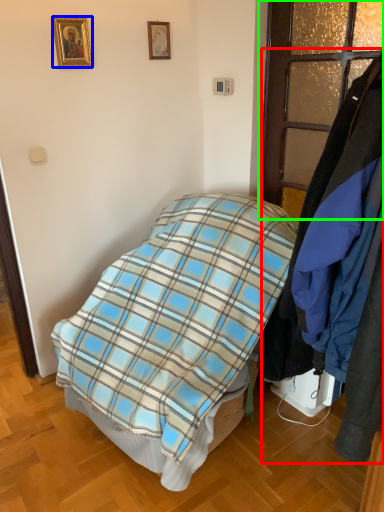
Question: Considering the real-world distances, which object is closest to closet (highlighted by a red box)? picture frame (highlighted by a blue box) or glass door (highlighted by a green box).

Choices:
 (A) picture frame
 (B) glass door

Answer: (B)